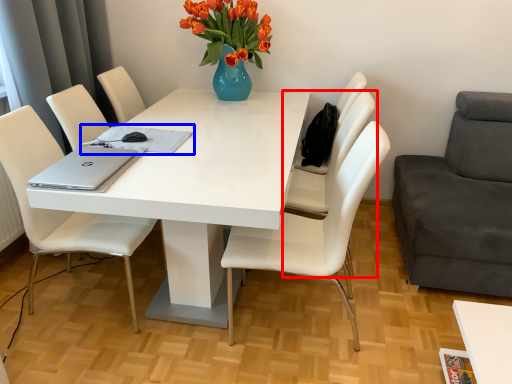
Question: Which of the following is the closest to the observer, chair (highlighted by a red box) or notepad (highlighted by a blue box)?

Choices:
 (A) chair
 (B) notepad

Answer: (B)